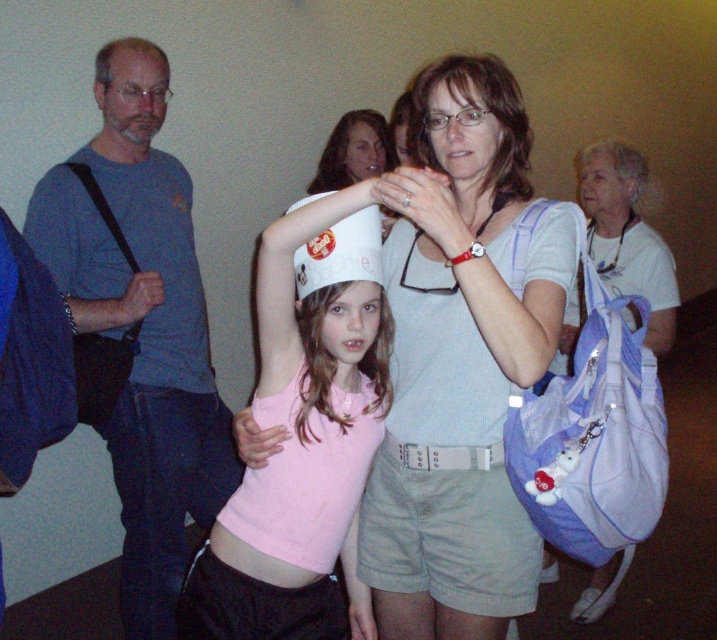
You are standing in the room and want to reach both the point at (x=214, y=509) and the point at (x=455, y=72). Which point should you go to first to reach the closer one?

You should go to point (x=214, y=509) first because it is closer to you than point (x=455, y=72).

You are standing at the point with coordinates point (x=394, y=145) and want to walk to the point with coordinates point (x=637, y=182). Is the destination point in front of you or behind you?

The point (x=637, y=182) is in front of point (x=394, y=145), so the destination point is in front of you.